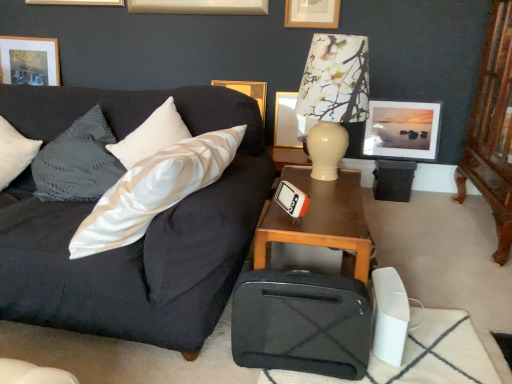
Question: Is matte gold picture frame at upper center, the 3th picture frame when ordered from right to left, thinner than matte gold picture frame at upper center, which appears as the 2th picture frame when viewed from the right?

Choices:
 (A) no
 (B) yes

Answer: (A)

Question: From a real-world perspective, is matte gold picture frame at upper center, the 3th picture frame when ordered from right to left, physically above matte gold picture frame at upper center, which appears as the 2th picture frame when viewed from the right?

Choices:
 (A) yes
 (B) no

Answer: (B)

Question: Is matte gold picture frame at upper center, which is the third picture frame in left-to-right order, beside matte gold picture frame at upper center, which appears as the 2th picture frame when viewed from the right?

Choices:
 (A) yes
 (B) no

Answer: (B)

Question: Does matte gold picture frame at upper center, the 3th picture frame when ordered from right to left, have a lesser height compared to matte gold picture frame at upper center, which ranks as the fourth picture frame in left-to-right order?

Choices:
 (A) no
 (B) yes

Answer: (A)

Question: Is matte gold picture frame at upper center, which is the third picture frame in left-to-right order, at the right side of matte gold picture frame at upper center, which ranks as the fourth picture frame in left-to-right order?

Choices:
 (A) yes
 (B) no

Answer: (B)

Question: From the image's perspective, would you say matte gold picture frame at upper center, which is the third picture frame in left-to-right order, is shown under matte gold picture frame at upper center, which ranks as the fourth picture frame in left-to-right order?

Choices:
 (A) yes
 (B) no

Answer: (A)

Question: From a real-world perspective, is matte gold picture frame at upper left, which is the fifth picture frame from right to left, positioned over matte gold picture frame at upper center, which appears as the 2th picture frame when viewed from the right, based on gravity?

Choices:
 (A) no
 (B) yes

Answer: (A)

Question: Is matte gold picture frame at upper left, positioned as the 1th picture frame in left-to-right order, wider than matte gold picture frame at upper center, which appears as the 2th picture frame when viewed from the right?

Choices:
 (A) yes
 (B) no

Answer: (A)

Question: Can you confirm if matte gold picture frame at upper left, which is the fifth picture frame from right to left, is shorter than matte gold picture frame at upper center, which appears as the 2th picture frame when viewed from the right?

Choices:
 (A) yes
 (B) no

Answer: (B)

Question: Is matte gold picture frame at upper left, which is the fifth picture frame from right to left, facing away from matte gold picture frame at upper center, which ranks as the fourth picture frame in left-to-right order?

Choices:
 (A) yes
 (B) no

Answer: (B)

Question: Is matte gold picture frame at upper left, which is the fifth picture frame from right to left, not near matte gold picture frame at upper center, which ranks as the fourth picture frame in left-to-right order?

Choices:
 (A) yes
 (B) no

Answer: (A)

Question: Can we say matte gold picture frame at upper left, which is the fifth picture frame from right to left, lies outside matte gold picture frame at upper center, which ranks as the fourth picture frame in left-to-right order?

Choices:
 (A) no
 (B) yes

Answer: (B)

Question: Is there a large distance between dark gray fabric couch at left and matte gold picture frame at upper center, the 3th picture frame when ordered from right to left?

Choices:
 (A) no
 (B) yes

Answer: (B)